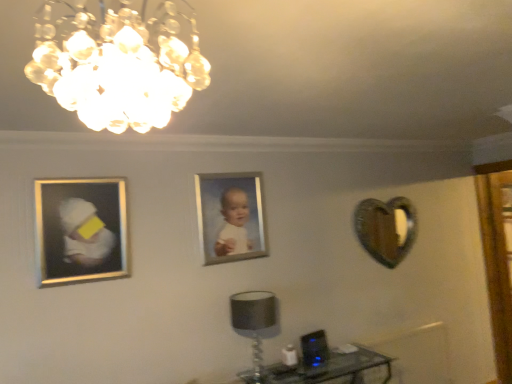
Question: Does silver metallic picture frame at center, the 1th picture frame viewed from the right, appear on the left side of silver/metallic picture frame at left, which is counted as the first picture frame, starting from the front?

Choices:
 (A) no
 (B) yes

Answer: (A)

Question: From the image's perspective, does silver metallic picture frame at center, the 1th picture frame viewed from the right, appear higher than silver/metallic picture frame at left, acting as the second picture frame starting from the right?

Choices:
 (A) no
 (B) yes

Answer: (B)

Question: From a real-world perspective, is silver metallic picture frame at center, the 2th picture frame viewed from the front, below silver/metallic picture frame at left, which is counted as the first picture frame, starting from the front?

Choices:
 (A) no
 (B) yes

Answer: (A)

Question: Is silver metallic picture frame at center, positioned as the 2th picture frame in left-to-right order, bigger than silver/metallic picture frame at left, marked as the 2th picture frame in a back-to-front arrangement?

Choices:
 (A) no
 (B) yes

Answer: (A)

Question: Is silver/metallic picture frame at left, marked as the 2th picture frame in a back-to-front arrangement, located within silver metallic picture frame at center, the 1th picture frame viewed from the right?

Choices:
 (A) no
 (B) yes

Answer: (A)

Question: Is clear glass chandelier at upper center taller or shorter than transparent glass table at lower right?

Choices:
 (A) short
 (B) tall

Answer: (A)

Question: Considering the positions of point click(x=175, y=77) and point click(x=328, y=377), is point click(x=175, y=77) closer or farther from the camera than point click(x=328, y=377)?

Choices:
 (A) farther
 (B) closer

Answer: (B)

Question: Based on their sizes in the image, would you say clear glass chandelier at upper center is bigger or smaller than transparent glass table at lower right?

Choices:
 (A) small
 (B) big

Answer: (A)

Question: From a real-world perspective, is clear glass chandelier at upper center above or below transparent glass table at lower right?

Choices:
 (A) below
 (B) above

Answer: (B)

Question: Does point (245, 173) appear closer or farther from the camera than point (397, 198)?

Choices:
 (A) farther
 (B) closer

Answer: (B)

Question: Considering the positions of silver metallic picture frame at center, the 1th picture frame viewed from the right, and metallic heart-shaped mirror at right in the image, is silver metallic picture frame at center, the 1th picture frame viewed from the right, bigger or smaller than metallic heart-shaped mirror at right?

Choices:
 (A) big
 (B) small

Answer: (B)

Question: Looking at their shapes, would you say silver metallic picture frame at center, the 1th picture frame viewed from the right, is wider or thinner than metallic heart-shaped mirror at right?

Choices:
 (A) wide
 (B) thin

Answer: (B)

Question: From a real-world perspective, relative to metallic heart-shaped mirror at right, is silver metallic picture frame at center, the first picture frame viewed from the back, vertically above or below?

Choices:
 (A) above
 (B) below

Answer: (A)

Question: Does point (381, 359) appear closer or farther from the camera than point (123, 46)?

Choices:
 (A) farther
 (B) closer

Answer: (A)

Question: In the image, is transparent glass table at lower right positioned in front of or behind clear glass chandelier at upper center?

Choices:
 (A) behind
 (B) front

Answer: (A)